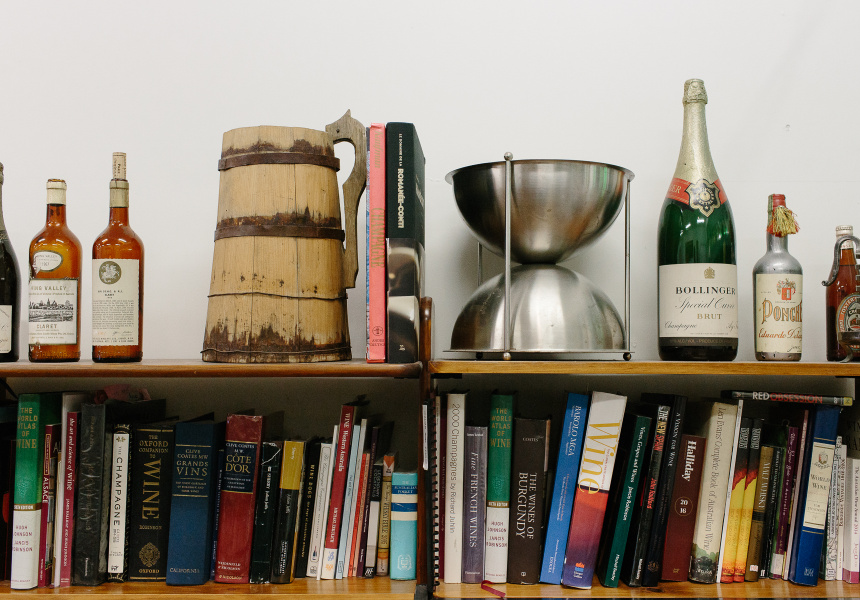
In order to click on pink book binder in this screenshot , I will do `click(377, 244)`.